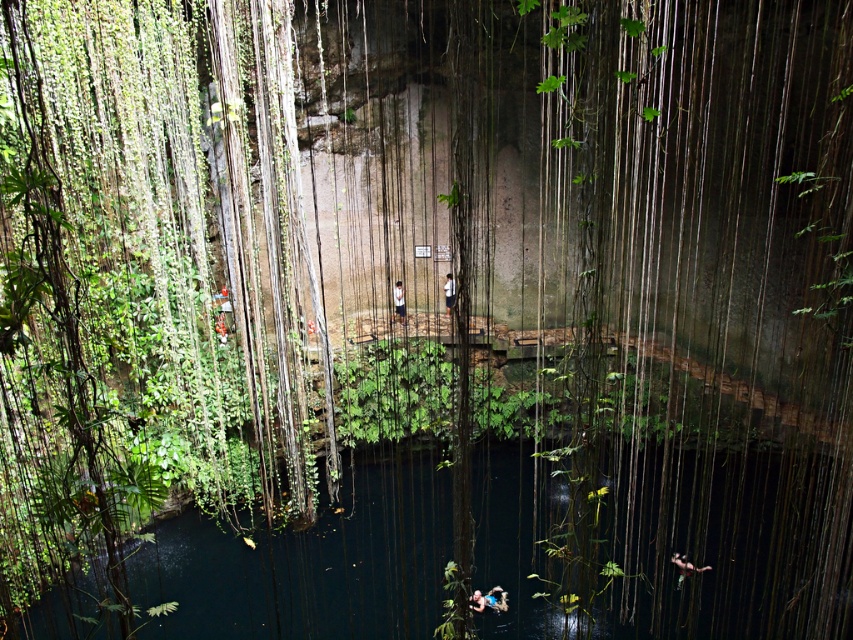
Measure the distance from light blue shirt at center to white fabric shirt at center.

light blue shirt at center is 5.08 feet from white fabric shirt at center.

Consider the image. Does light blue shirt at center lie in front of white fabric shirt at center?

No, light blue shirt at center is further to the viewer.

Is point (396, 289) closer to viewer compared to point (448, 280)?

That is True.

The image size is (853, 640). I want to click on light blue shirt at center, so click(x=398, y=301).

Can you confirm if dark blue water at center is positioned to the left of white fabric shirt at center?

No, dark blue water at center is not to the left of white fabric shirt at center.

Can you confirm if dark blue water at center is taller than white fabric shirt at center?

Correct, dark blue water at center is much taller as white fabric shirt at center.

Is point (398, 524) positioned before point (448, 314)?

Yes, point (398, 524) is in front of point (448, 314).

At what (x,y) coordinates should I click in order to perform the action: click on dark blue water at center. Please return your answer as a coordinate pair (x, y). The image size is (853, 640). Looking at the image, I should click on (730, 548).

Can you confirm if dark blue water at center is bigger than light blue shirt at center?

Indeed, dark blue water at center has a larger size compared to light blue shirt at center.

Is dark blue water at center behind light blue shirt at center?

That is False.

Is point (171, 534) positioned behind point (395, 298)?

No, (171, 534) is closer to viewer.

Find the location of `dark blue water at center`. dark blue water at center is located at coordinates (730, 548).